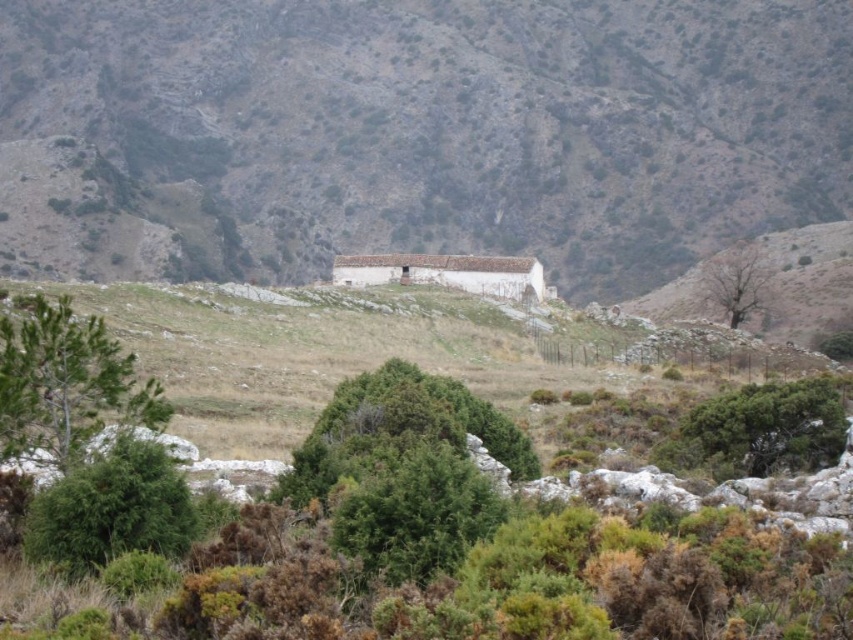
Question: Is green leafy shrub at lower left wider than green leafy shrub at center?

Choices:
 (A) yes
 (B) no

Answer: (B)

Question: Among these points, which one is nearest to the camera?

Choices:
 (A) (711, 440)
 (B) (67, 417)
 (C) (131, 515)

Answer: (C)

Question: Is brown rocky mountain at center to the right of green leafy tree at left from the viewer's perspective?

Choices:
 (A) yes
 (B) no

Answer: (A)

Question: Does green leafy tree at left come behind green leafy shrub at center?

Choices:
 (A) no
 (B) yes

Answer: (A)

Question: Which of the following is the farthest from the observer?

Choices:
 (A) (422, 502)
 (B) (726, 468)
 (C) (845, 51)
 (D) (27, 422)

Answer: (C)

Question: Among these objects, which one is nearest to the camera?

Choices:
 (A) green leafy shrub at center
 (B) green leafy tree at left
 (C) bare wood tree at upper right
 (D) green leafy shrub at lower left

Answer: (D)